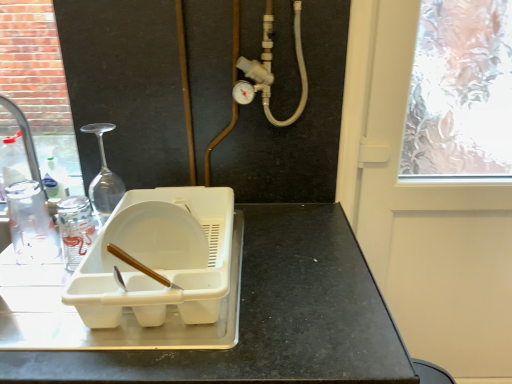
Locate an element on the screen. Image resolution: width=512 pixels, height=384 pixels. white plastic tray at center is located at coordinates (271, 316).

Locate an element on the screen. This screenshot has width=512, height=384. transparent frosted glass screen door at upper right is located at coordinates point(422,212).

In order to click on brushed metal faucet at left in this screenshot , I will do `click(24, 137)`.

From a real-world perspective, which object stands above the other?

brushed metal faucet at left is physically above.

Is point (32, 176) closer to viewer compared to point (129, 353)?

No, (32, 176) is behind (129, 353).

How much distance is there between white plastic tray at center and clear plastic bottle at left?

white plastic tray at center is 15.94 inches away from clear plastic bottle at left.

Considering the relative sizes of white plastic tray at center and clear plastic bottle at left in the image provided, is white plastic tray at center smaller than clear plastic bottle at left?

Incorrect, white plastic tray at center is not smaller in size than clear plastic bottle at left.

Is white plastic tray at center closer to camera compared to clear plastic bottle at left?

That is True.

From the picture: Is white plastic tray at center at the left side of clear plastic bottle at left?

Incorrect, white plastic tray at center is not on the left side of clear plastic bottle at left.

Who is smaller, transparent frosted glass screen door at upper right or clear plastic bottle at left?

clear plastic bottle at left.

Is transparent frosted glass screen door at upper right positioned far away from clear plastic bottle at left?

Actually, transparent frosted glass screen door at upper right and clear plastic bottle at left are a little close together.

Does transparent frosted glass screen door at upper right appear on the right side of clear plastic bottle at left?

Indeed, transparent frosted glass screen door at upper right is positioned on the right side of clear plastic bottle at left.

Between white plastic tray at center and transparent frosted glass screen door at upper right, which one has more height?

With more height is transparent frosted glass screen door at upper right.

Would you consider white plastic tray at center to be distant from transparent frosted glass screen door at upper right?

No, white plastic tray at center is not far from transparent frosted glass screen door at upper right.

Is point (338, 273) farther from camera compared to point (486, 353)?

No, (338, 273) is closer to viewer.

Is white plastic tray at center aimed at transparent frosted glass screen door at upper right?

No, white plastic tray at center is not turned towards transparent frosted glass screen door at upper right.

Is the depth of clear plastic bottle at left greater than that of white plastic dish rack at center?

Yes, it is behind white plastic dish rack at center.

From the image's perspective, which one is positioned higher, clear plastic bottle at left or white plastic dish rack at center?

clear plastic bottle at left appears higher in the image.

Does point (78, 260) lie behind point (169, 291)?

Yes.

From the picture: From a real-world perspective, between brushed metal faucet at left and clear plastic bottle at left, who is vertically higher?

brushed metal faucet at left, from a real-world perspective.

How different are the orientations of brushed metal faucet at left and clear plastic bottle at left in degrees?

3.41 degrees separate the facing orientations of brushed metal faucet at left and clear plastic bottle at left.

Between brushed metal faucet at left and clear plastic bottle at left, which one appears on the right side from the viewer's perspective?

clear plastic bottle at left.

In the image, is brushed metal faucet at left positioned in front of or behind clear plastic bottle at left?

Clearly, brushed metal faucet at left is behind clear plastic bottle at left.

Is clear plastic bottle at left inside the boundaries of brushed metal faucet at left, or outside?

clear plastic bottle at left exists outside the volume of brushed metal faucet at left.

From the picture: Which of these two, clear plastic bottle at left or brushed metal faucet at left, stands taller?

Standing taller between the two is brushed metal faucet at left.

Who is smaller, clear plastic bottle at left or brushed metal faucet at left?

Smaller between the two is clear plastic bottle at left.

From the image's perspective, which one is positioned higher, clear plastic bottle at left or brushed metal faucet at left?

brushed metal faucet at left, from the image's perspective.

Where is `countertop lying in front of the brushed metal faucet at left`? The width and height of the screenshot is (512, 384). countertop lying in front of the brushed metal faucet at left is located at coordinates (271, 316).

Find the location of a particular element. The image size is (512, 384). countertop located underneath the clear plastic bottle at left (from a real-world perspective) is located at coordinates (271, 316).

When comparing their distances from white plastic dish rack at center, does white plastic tray at center or brushed metal faucet at left seem closer?

The object closer to white plastic dish rack at center is white plastic tray at center.

Estimate the real-world distances between objects in this image. Which object is further from transparent frosted glass screen door at upper right, clear plastic bottle at left or brushed metal faucet at left?

The object further to transparent frosted glass screen door at upper right is brushed metal faucet at left.

From the image, which object appears to be farther from clear plastic bottle at left, white plastic tray at center or brushed metal faucet at left?

Among the two, white plastic tray at center is located further to clear plastic bottle at left.

Which object lies further to the anchor point transparent frosted glass screen door at upper right, brushed metal faucet at left or clear plastic bottle at left?

brushed metal faucet at left is positioned further to the anchor transparent frosted glass screen door at upper right.

When comparing their distances from clear plastic bottle at left, does transparent frosted glass screen door at upper right or brushed metal faucet at left seem further?

transparent frosted glass screen door at upper right.

Considering their positions, is white plastic tray at center positioned closer to transparent frosted glass screen door at upper right than brushed metal faucet at left?

white plastic tray at center is closer to transparent frosted glass screen door at upper right.

When comparing their distances from clear plastic bottle at left, does transparent frosted glass screen door at upper right or white plastic tray at center seem closer?

white plastic tray at center is closer to clear plastic bottle at left.

Looking at the image, which one is located closer to transparent frosted glass screen door at upper right, white plastic dish rack at center or brushed metal faucet at left?

The object closer to transparent frosted glass screen door at upper right is white plastic dish rack at center.

The image size is (512, 384). In order to click on appliance positioned between white plastic tray at center and brushed metal faucet at left from near to far in this screenshot , I will do `click(159, 257)`.

Identify the location of bottle between brushed metal faucet at left and white plastic tray at center in the up-down direction. (75, 229).

This screenshot has height=384, width=512. Find the location of `appliance that lies between clear plastic bottle at left and white plastic tray at center from top to bottom`. appliance that lies between clear plastic bottle at left and white plastic tray at center from top to bottom is located at coordinates (159, 257).

Where is `bottle located between brushed metal faucet at left and white plastic dish rack at center in the left-right direction`? bottle located between brushed metal faucet at left and white plastic dish rack at center in the left-right direction is located at coordinates (75, 229).